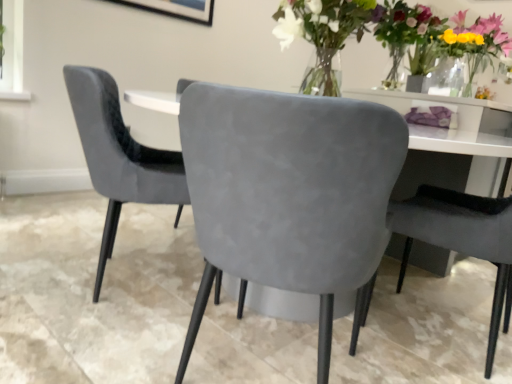
Question: Considering the relative positions of matte glass vase at upper right and suede gray chair at center, marked as the third chair in a left-to-right arrangement, in the image provided, is matte glass vase at upper right in front of suede gray chair at center, marked as the third chair in a left-to-right arrangement,?

Choices:
 (A) yes
 (B) no

Answer: (B)

Question: Can you confirm if matte glass vase at upper right is bigger than suede gray chair at center, which ranks as the first chair in right-to-left order?

Choices:
 (A) yes
 (B) no

Answer: (B)

Question: Is suede gray chair at center, which ranks as the first chair in right-to-left order, at the back of matte glass vase at upper right?

Choices:
 (A) yes
 (B) no

Answer: (B)

Question: From the image's perspective, would you say matte glass vase at upper right is shown under suede gray chair at center, which ranks as the first chair in right-to-left order?

Choices:
 (A) no
 (B) yes

Answer: (A)

Question: Considering the relative sizes of matte glass vase at upper right and suede gray chair at center, marked as the third chair in a left-to-right arrangement, in the image provided, is matte glass vase at upper right thinner than suede gray chair at center, marked as the third chair in a left-to-right arrangement,?

Choices:
 (A) yes
 (B) no

Answer: (A)

Question: From a real-world perspective, is suede gray chair at center, which ranks as the first chair in right-to-left order, above or below suede gray chair at center, placed as the second chair when sorted from left to right?

Choices:
 (A) above
 (B) below

Answer: (B)

Question: From their relative heights in the image, would you say suede gray chair at center, marked as the third chair in a left-to-right arrangement, is taller or shorter than suede gray chair at center, placed as the second chair when sorted from left to right?

Choices:
 (A) short
 (B) tall

Answer: (A)

Question: In terms of width, does suede gray chair at center, which ranks as the first chair in right-to-left order, look wider or thinner when compared to suede gray chair at center, which appears as the second chair when viewed from the right?

Choices:
 (A) thin
 (B) wide

Answer: (A)

Question: Based on their sizes in the image, would you say suede gray chair at center, which ranks as the first chair in right-to-left order, is bigger or smaller than suede gray chair at center, which appears as the second chair when viewed from the right?

Choices:
 (A) small
 (B) big

Answer: (A)

Question: Considering the positions of point (493, 38) and point (415, 193), is point (493, 38) closer or farther from the camera than point (415, 193)?

Choices:
 (A) closer
 (B) farther

Answer: (B)

Question: Is matte glass vase at upper right wider or thinner than suede gray chair at center, which ranks as the first chair in right-to-left order?

Choices:
 (A) wide
 (B) thin

Answer: (B)

Question: In the image, is matte glass vase at upper right positioned in front of or behind suede gray chair at center, which ranks as the first chair in right-to-left order?

Choices:
 (A) front
 (B) behind

Answer: (B)

Question: Is matte glass vase at upper right bigger or smaller than suede gray chair at center, marked as the third chair in a left-to-right arrangement?

Choices:
 (A) big
 (B) small

Answer: (B)

Question: Visually, is suede gray chair at center, marked as the third chair in a left-to-right arrangement, positioned to the left or to the right of velvet grey chair at center, placed as the first chair when sorted from left to right?

Choices:
 (A) right
 (B) left

Answer: (A)

Question: From the image's perspective, is suede gray chair at center, marked as the third chair in a left-to-right arrangement, above or below velvet grey chair at center, which is the third chair from right to left?

Choices:
 (A) below
 (B) above

Answer: (A)